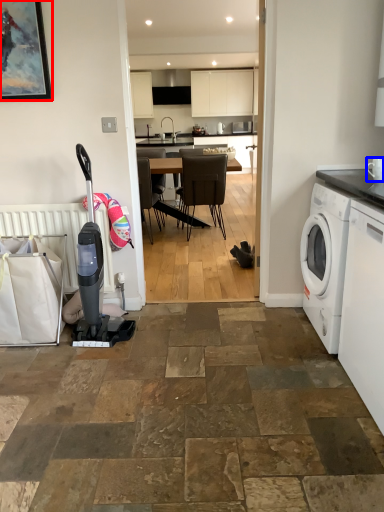
Question: Which object appears farthest to the camera in this image, picture frame (highlighted by a red box) or appliance (highlighted by a blue box)?

Choices:
 (A) picture frame
 (B) appliance

Answer: (A)